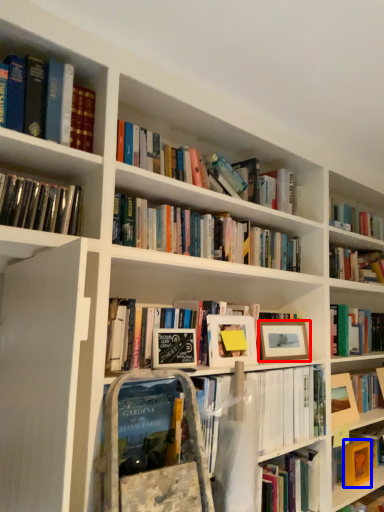
Question: Which point is further to the camera, picture frame (highlighted by a red box) or paperback book (highlighted by a blue box)?

Choices:
 (A) picture frame
 (B) paperback book

Answer: (B)